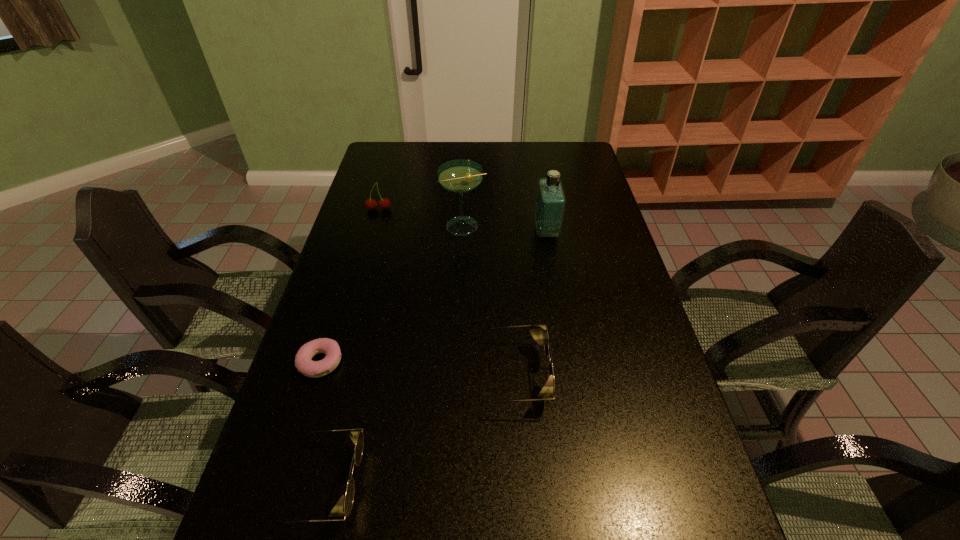
Locate an element on the screen. Image resolution: width=960 pixels, height=540 pixels. free space between the martini and the cherry is located at coordinates (421, 218).

In order to click on vacant area that lies between the shortest object and the martini in this screenshot , I will do `click(393, 294)`.

Image resolution: width=960 pixels, height=540 pixels. Identify the location of vacant point located between the rightmost object and the martini. (505, 229).

Where is `free area in between the doughnut and the martini`? free area in between the doughnut and the martini is located at coordinates (393, 294).

At what (x,y) coordinates should I click in order to perform the action: click on vacant space in between the martini and the fifth tallest object. Please return your answer as a coordinate pair (x, y). This screenshot has width=960, height=540. Looking at the image, I should click on (393, 355).

You are a GUI agent. You are given a task and a screenshot of the screen. Output one action in this format:
    pyautogui.click(x=<x>, y=<y>)
    Task: Click on the free space between the shortest object and the rightmost object
    This screenshot has height=540, width=960.
    Given the screenshot: What is the action you would take?
    pyautogui.click(x=434, y=297)

Select which object appears as the second closest to the nearer sunglasses. Please provide its 2D coordinates. Your answer should be formatted as a tuple, i.e. [(x, y)], where the tuple contains the x and y coordinates of a point satisfying the conditions above.

[(547, 393)]

This screenshot has height=540, width=960. Identify the location of object that ranks as the second closest to the nearest object. (547, 393).